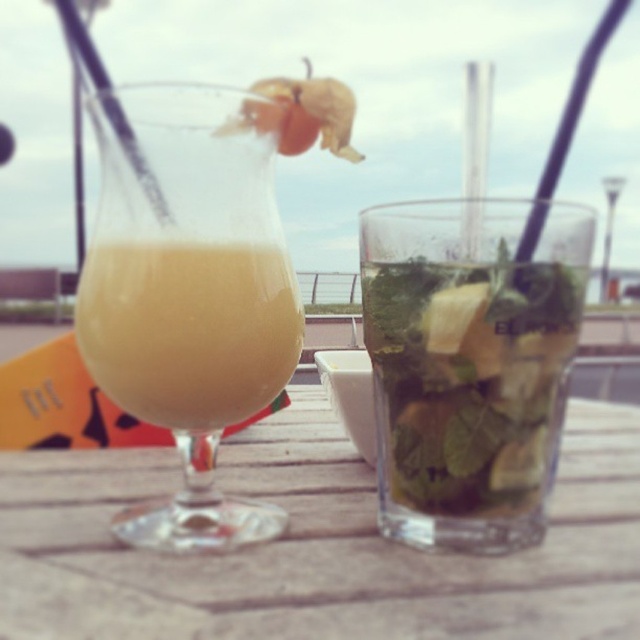
Based on the photo, you are a customer at a cafe holding a phone 6 inches away from your face. You want to take a closeup photo of the green leafy liquid at center. Can you position your phone close enough to capture the liquid without moving the glass?

The green leafy liquid at center and viewer are 6.72 inches apart from each other. Since your phone is held 6 inches away from your face, the total distance between the phone and the liquid would be 6.72 minus 6, which is 0.72 inches. This is very close, so yes, you can take the photo without moving the glass.